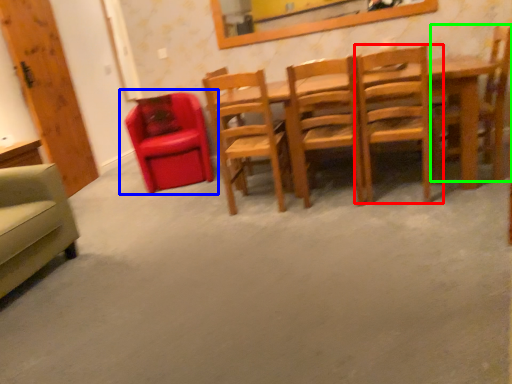
Question: Based on their relative distances, which object is nearer to chair (highlighted by a red box)? Choose from chair (highlighted by a blue box) and chair (highlighted by a green box).

Choices:
 (A) chair
 (B) chair

Answer: (B)